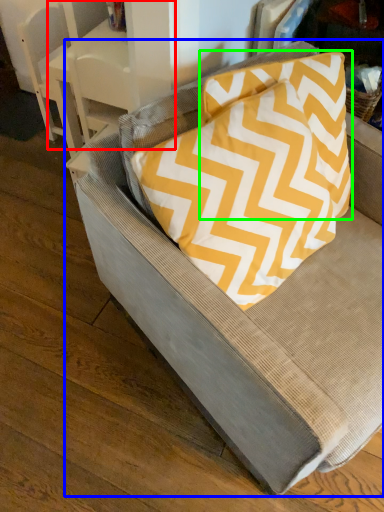
Question: Which object is the closest to the table (highlighted by a red box)? Choose among these: chair (highlighted by a blue box) or pillow (highlighted by a green box).

Choices:
 (A) chair
 (B) pillow

Answer: (B)